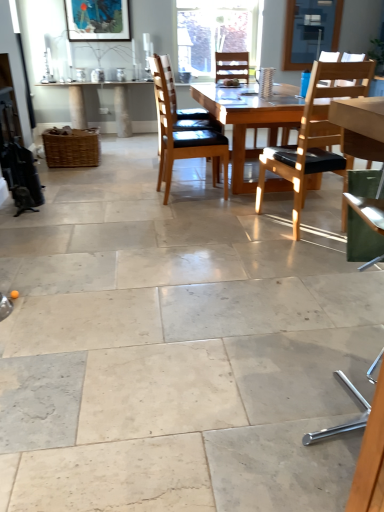
Question: From their relative heights in the image, would you say transparent glass window screen at upper center is taller or shorter than brown leather chair at center, acting as the 1th chair starting from the left?

Choices:
 (A) short
 (B) tall

Answer: (A)

Question: From a real-world perspective, is transparent glass window screen at upper center above or below brown leather chair at center, acting as the 1th chair starting from the left?

Choices:
 (A) below
 (B) above

Answer: (B)

Question: Estimate the real-world distances between objects in this image. Which object is closer to the light brown wood chair at center right, the second chair positioned from the back?

Choices:
 (A) transparent glass window at upper center
 (B) wooden table at center
 (C) brown leather chair at center, the third chair when ordered from right to left
 (D) matte wooden picture frame at upper center
 (E) green fabric chair at right, the 3th chair from the back

Answer: (B)

Question: Based on their relative distances, which object is farther from the transparent glass window screen at upper center?

Choices:
 (A) wooden table at center
 (B) matte wooden picture frame at upper center
 (C) green fabric chair at right, the 3th chair from the back
 (D) brown leather chair at center, the third chair when ordered from right to left
 (E) transparent glass window at upper center

Answer: (C)